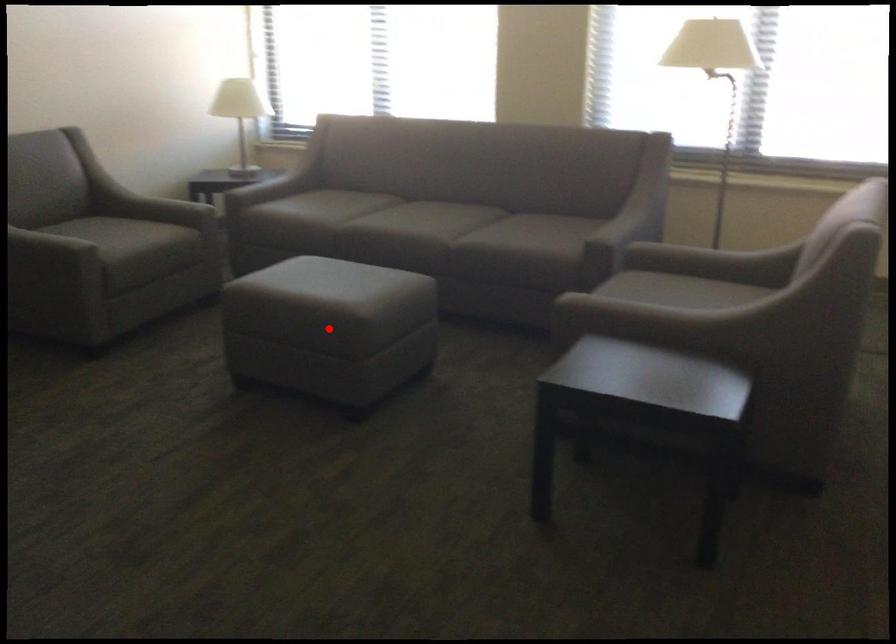
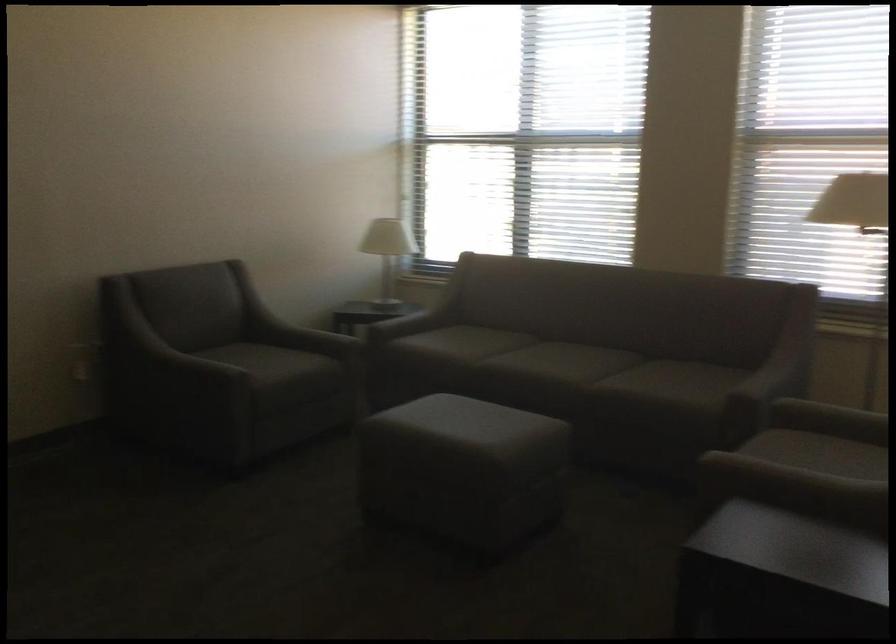
In the second image, find the point that corresponds to the highlighted location in the first image.

(462, 469)